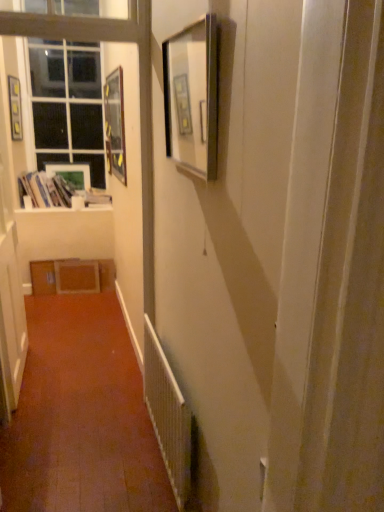
Question: Can you confirm if white textured radiator at lower center is smaller than matte wooden picture frame at upper left, placed as the first picture frame when sorted from back to front?

Choices:
 (A) yes
 (B) no

Answer: (B)

Question: Is white textured radiator at lower center in contact with matte wooden picture frame at upper left, the 3th picture frame from the right?

Choices:
 (A) no
 (B) yes

Answer: (A)

Question: Is white textured radiator at lower center positioned in front of matte wooden picture frame at upper left, placed as the first picture frame when sorted from back to front?

Choices:
 (A) no
 (B) yes

Answer: (B)

Question: Does white textured radiator at lower center have a lesser height compared to matte wooden picture frame at upper left, the 3th picture frame from the right?

Choices:
 (A) no
 (B) yes

Answer: (A)

Question: Would you say white textured radiator at lower center is a long distance from matte wooden picture frame at upper left, the 2th picture frame viewed from the left?

Choices:
 (A) no
 (B) yes

Answer: (B)

Question: Does white textured radiator at lower center lie behind matte wooden picture frame at upper left, placed as the first picture frame when sorted from back to front?

Choices:
 (A) no
 (B) yes

Answer: (A)

Question: Would you say white textured radiator at lower center is part of matte black picture frame at upper center, marked as the 4th picture frame in a left-to-right arrangement,'s contents?

Choices:
 (A) no
 (B) yes

Answer: (A)

Question: Does matte black picture frame at upper center, marked as the 4th picture frame in a left-to-right arrangement, turn towards white textured radiator at lower center?

Choices:
 (A) yes
 (B) no

Answer: (B)

Question: Is matte black picture frame at upper center, positioned as the fourth picture frame in back-to-front order, taller than white textured radiator at lower center?

Choices:
 (A) no
 (B) yes

Answer: (A)

Question: Is matte black picture frame at upper center, positioned as the fourth picture frame in back-to-front order, not within white textured radiator at lower center?

Choices:
 (A) yes
 (B) no

Answer: (A)

Question: Does matte black picture frame at upper center, which is the first picture frame from front to back, have a greater width compared to white textured radiator at lower center?

Choices:
 (A) no
 (B) yes

Answer: (A)

Question: Considering the relative sizes of matte black picture frame at upper center, positioned as the fourth picture frame in back-to-front order, and white textured radiator at lower center in the image provided, is matte black picture frame at upper center, positioned as the fourth picture frame in back-to-front order, shorter than white textured radiator at lower center?

Choices:
 (A) yes
 (B) no

Answer: (A)

Question: Does white paper stack at left appear on the left side of matte wooden picture frame at upper left, the third picture frame positioned from the left?

Choices:
 (A) no
 (B) yes

Answer: (B)